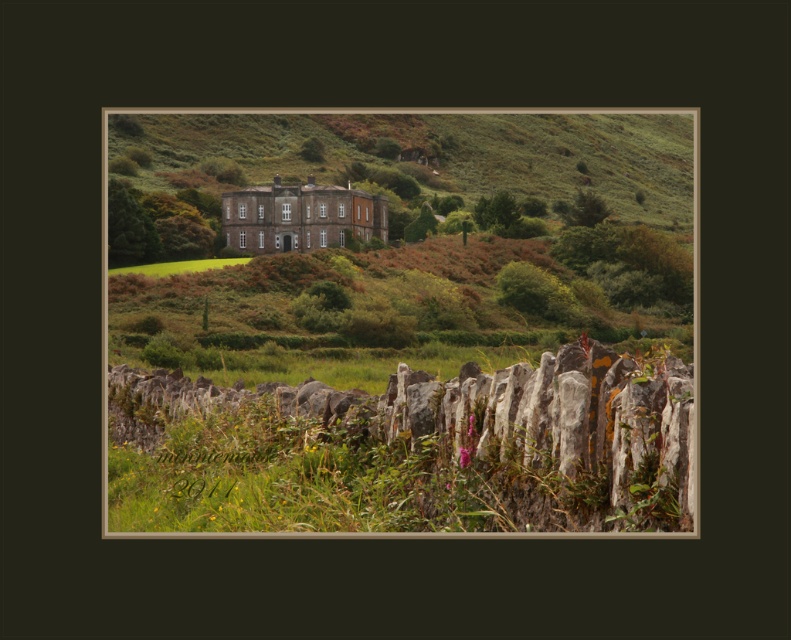
Question: Can you confirm if gray stone fence at lower center is bigger than green grass at center?

Choices:
 (A) no
 (B) yes

Answer: (B)

Question: Does gray stone fence at lower center appear over green grass at center?

Choices:
 (A) no
 (B) yes

Answer: (A)

Question: Does gray stone fence at lower center have a greater width compared to green grass at center?

Choices:
 (A) yes
 (B) no

Answer: (A)

Question: Which object is closer to the camera taking this photo?

Choices:
 (A) gray stone fence at lower center
 (B) green grass at center

Answer: (A)